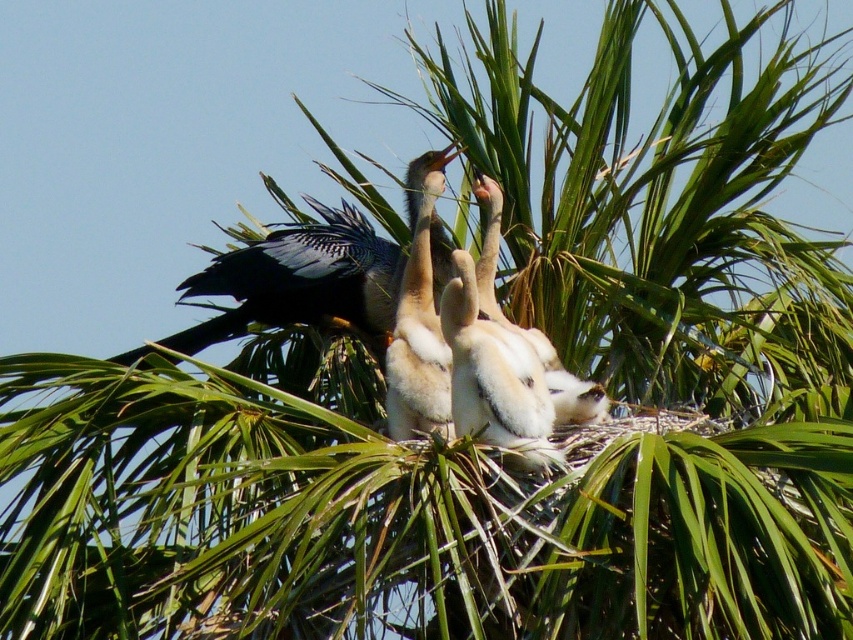
You are a wildlife photographer observing the scene. You notice the white fluffy nestling at center and the white downy feathers at center. Which one is positioned higher in the image?

The white fluffy nestling at center is positioned higher than the white downy feathers at center in the image.

You are a photographer trying to capture the bird feeding its chicks. You notice two points in the scene at coordinates point (221, 316) and point (535, 332). Which point is closer to your camera lens?

Point (221, 316) is closer to the camera lens because it is further to the camera than point (535, 332).